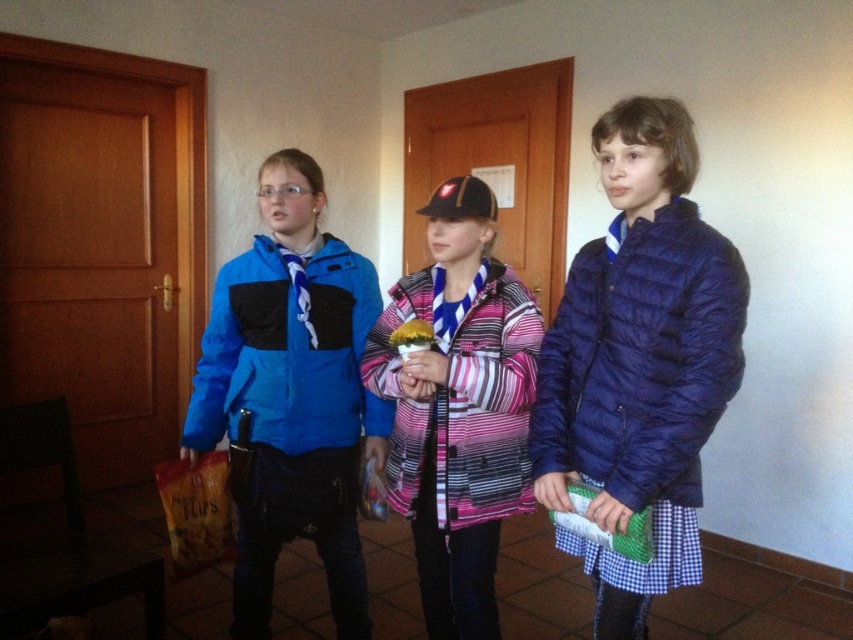
You are a delivery robot with a package that needs to be placed between the blue fabric jacket at left and the pink striped jacket at center. The package is 12 inches long. Can you fit the package between them?

The distance between the blue fabric jacket at left and the pink striped jacket at center is 11.17 inches. Since the package is 12 inches long, it cannot fit between them as the space is slightly smaller than the package.

You are a photographer trying to capture a group photo of the children. Since the pink striped jacket at center and the matte blue puffer jacket at right are at different heights, which child should you position closer to the camera to ensure both are visible in the frame?

The matte blue puffer jacket at right is shorter than the pink striped jacket at center. To ensure both are visible, position the matte blue puffer jacket at right closer to the camera so their height matches the pink striped jacket at center.

You are a photographer trying to capture a photo of the blue synthetic jacket at left without the pink striped jacket at center blocking it. What should you do?

Move to the side so that the pink striped jacket at center is no longer in front of the blue synthetic jacket at left.